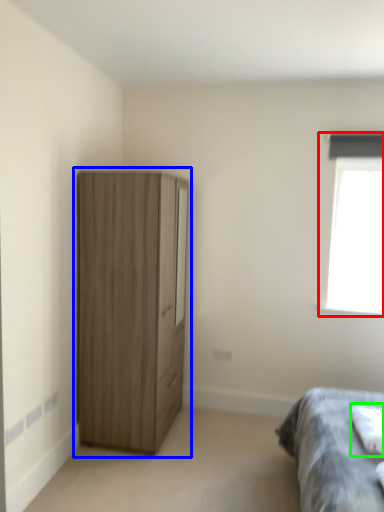
Question: Which is farther away from window (highlighted by a red box)? cupboard (highlighted by a blue box) or sheet (highlighted by a green box)?

Choices:
 (A) cupboard
 (B) sheet

Answer: (A)